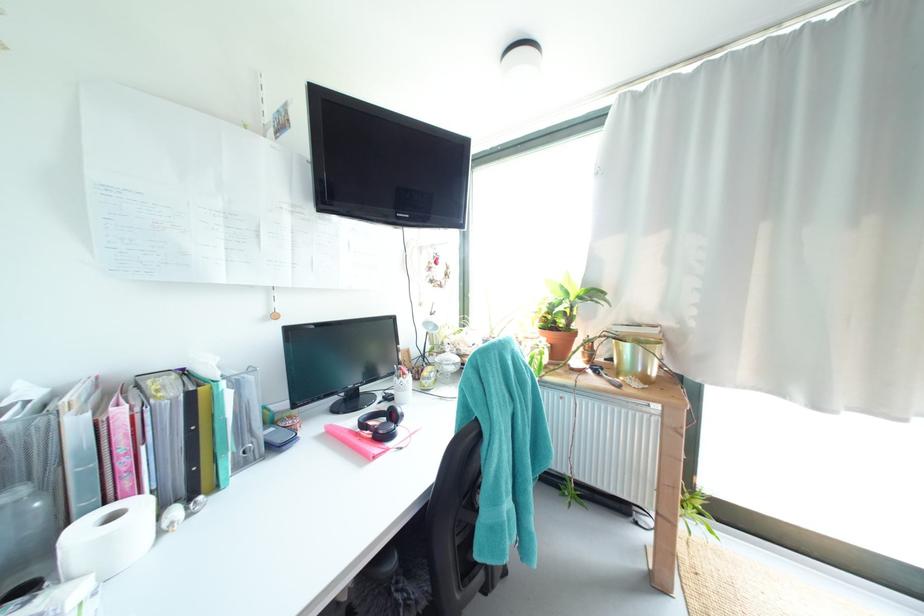
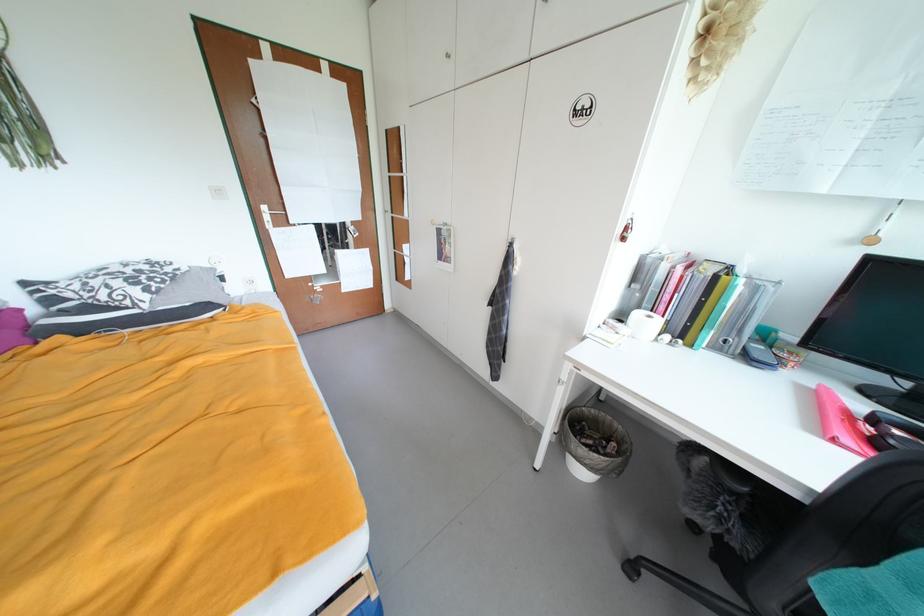
Based on the continuous images, in which direction is the camera rotating?

The camera rotated toward left-down.